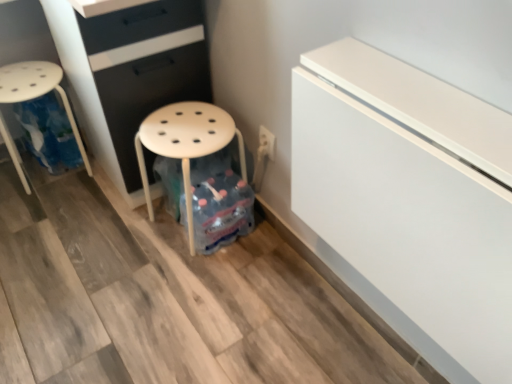
Question: Is white matte stool at center facing towards white glossy fridge at upper right?

Choices:
 (A) yes
 (B) no

Answer: (B)

Question: Is white matte stool at center in front of white glossy fridge at upper right?

Choices:
 (A) yes
 (B) no

Answer: (B)

Question: Considering the relative sizes of white matte stool at center and white glossy fridge at upper right in the image provided, is white matte stool at center thinner than white glossy fridge at upper right?

Choices:
 (A) yes
 (B) no

Answer: (B)

Question: Would you say white matte stool at center is outside white glossy fridge at upper right?

Choices:
 (A) no
 (B) yes

Answer: (B)

Question: Is white matte stool at center at the right side of white glossy fridge at upper right?

Choices:
 (A) no
 (B) yes

Answer: (A)

Question: From a real-world perspective, relative to white plastic stool at left, is white glossy fridge at upper right vertically above or below?

Choices:
 (A) below
 (B) above

Answer: (B)

Question: Is white glossy fridge at upper right taller or shorter than white plastic stool at left?

Choices:
 (A) tall
 (B) short

Answer: (A)

Question: From the image's perspective, is white glossy fridge at upper right above or below white plastic stool at left?

Choices:
 (A) above
 (B) below

Answer: (B)

Question: Based on their positions, is white glossy fridge at upper right located to the left or right of white plastic stool at left?

Choices:
 (A) left
 (B) right

Answer: (B)

Question: Based on their positions, is matte black chest of drawers at center located to the left or right of white glossy fridge at upper right?

Choices:
 (A) right
 (B) left

Answer: (B)

Question: Looking at the image, does matte black chest of drawers at center seem bigger or smaller compared to white glossy fridge at upper right?

Choices:
 (A) big
 (B) small

Answer: (A)

Question: Is point (179, 92) closer or farther from the camera than point (385, 215)?

Choices:
 (A) farther
 (B) closer

Answer: (A)

Question: Is matte black chest of drawers at center taller or shorter than white glossy fridge at upper right?

Choices:
 (A) tall
 (B) short

Answer: (A)

Question: From the image's perspective, is white glossy fridge at upper right above or below white matte stool at center?

Choices:
 (A) above
 (B) below

Answer: (B)

Question: Is white glossy fridge at upper right inside or outside of white matte stool at center?

Choices:
 (A) outside
 (B) inside

Answer: (A)